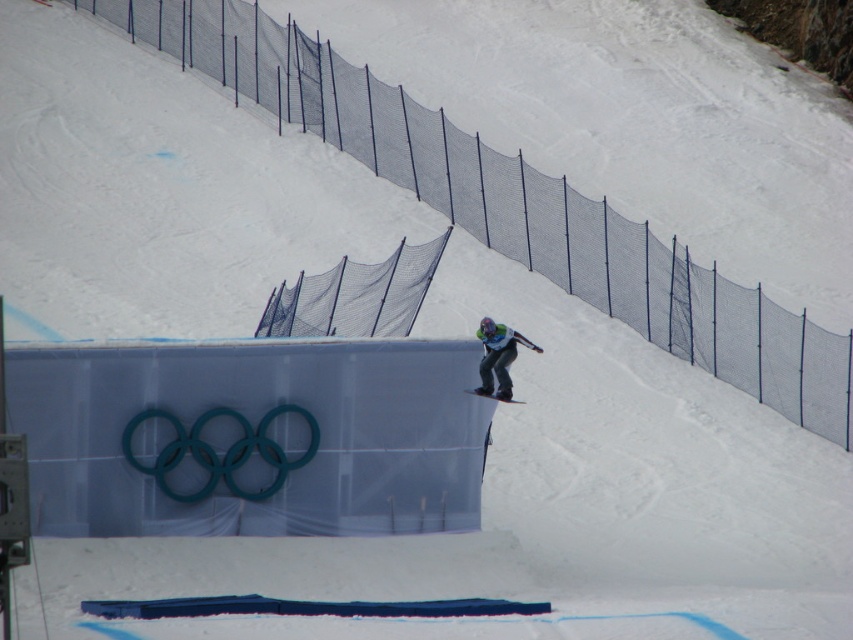
Can you confirm if green fabric snowboarder at center is shorter than matte black snowboard at center?

In fact, green fabric snowboarder at center may be taller than matte black snowboard at center.

Which of these two, green fabric snowboarder at center or matte black snowboard at center, stands taller?

With more height is green fabric snowboarder at center.

Is point (503, 394) closer to camera compared to point (514, 401)?

No.

At what (x,y) coordinates should I click in order to perform the action: click on green fabric snowboarder at center. Please return your answer as a coordinate pair (x, y). Looking at the image, I should click on (498, 356).